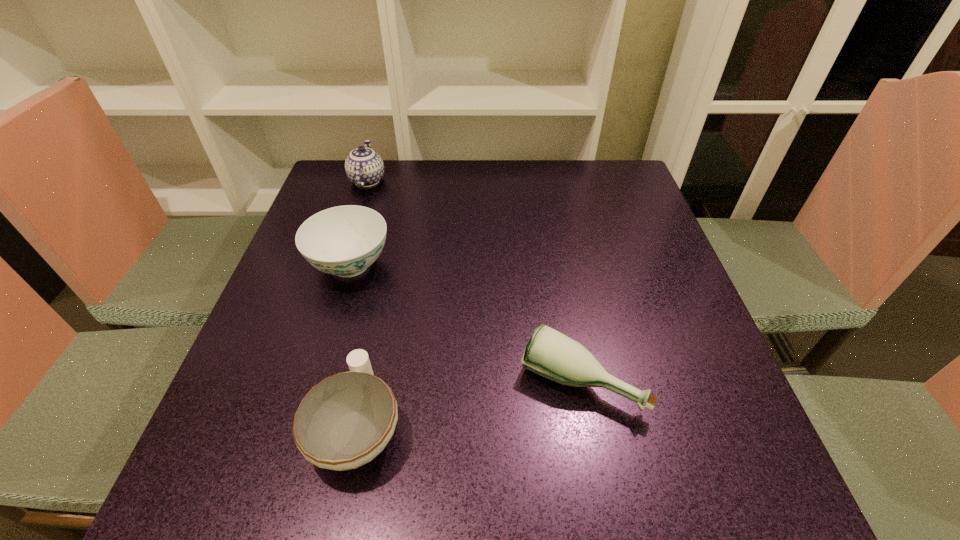
This screenshot has height=540, width=960. In order to click on the farthest chinaware in this screenshot , I will do `click(364, 167)`.

The image size is (960, 540). In order to click on the second nearest chinaware in this screenshot , I will do `click(345, 240)`.

The height and width of the screenshot is (540, 960). I want to click on the rightmost object, so click(549, 353).

The width and height of the screenshot is (960, 540). Find the location of `the shortest chinaware`. the shortest chinaware is located at coordinates (345, 421).

The image size is (960, 540). What are the coordinates of `vacant region located on the back of the second farthest object` in the screenshot? It's located at (365, 218).

What are the coordinates of `free space located 0.300m on the left of the rightmost object` in the screenshot? It's located at (349, 381).

Identify the location of blank area located on the side with the handle of the shortest chinaware. (391, 267).

At what (x,y) coordinates should I click in order to perform the action: click on free region located 0.230m on the side with the handle of the shortest chinaware. Please return your answer as a coordinate pair (x, y). Looking at the image, I should click on (387, 284).

At what (x,y) coordinates should I click in order to perform the action: click on free region located on the side with the handle of the shortest chinaware. Please return your answer as a coordinate pair (x, y). The height and width of the screenshot is (540, 960). Looking at the image, I should click on (375, 340).

You are a GUI agent. You are given a task and a screenshot of the screen. Output one action in this format:
    pyautogui.click(x=<x>, y=<y>)
    Task: Click on the object that is at the far edge
    
    Given the screenshot: What is the action you would take?
    pyautogui.click(x=364, y=167)